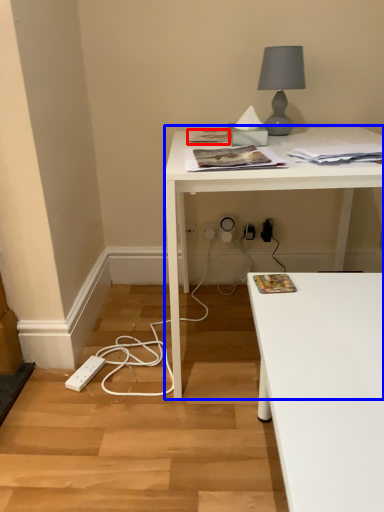
Question: Which object appears closest to the camera in this image, magazine (highlighted by a red box) or desk (highlighted by a blue box)?

Choices:
 (A) magazine
 (B) desk

Answer: (B)